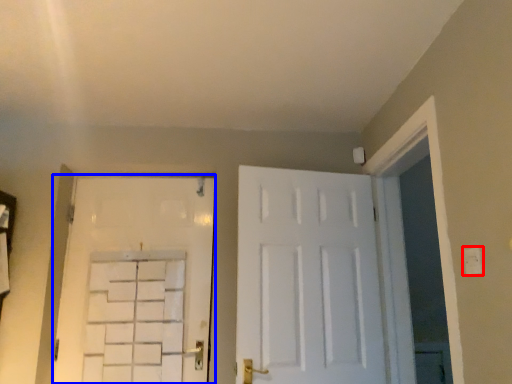
Question: Which object appears farthest to the camera in this image, electric outlet (highlighted by a red box) or door (highlighted by a blue box)?

Choices:
 (A) electric outlet
 (B) door

Answer: (B)